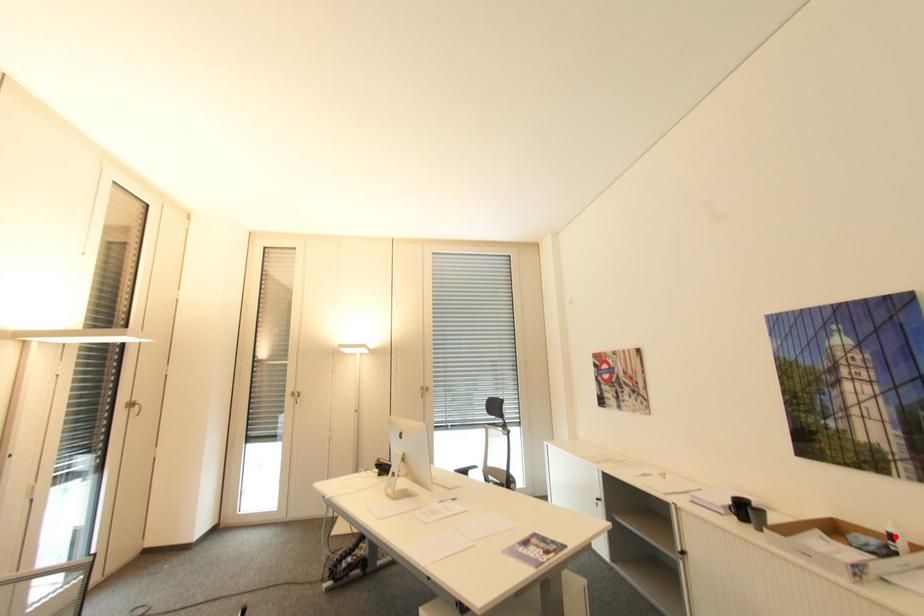
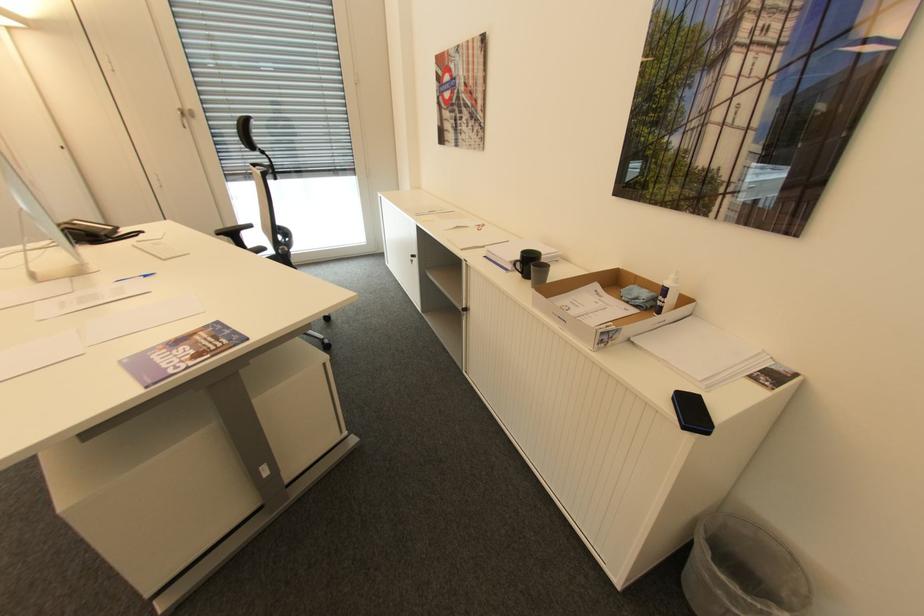
Question: A red point is marked in image1. In image2, is the corresponding 3D point closer to the camera or farther? Reply with the corresponding letter.

Choices:
 (A) The corresponding 3D point is closer.
 (B) The corresponding 3D point is farther.

Answer: (B)